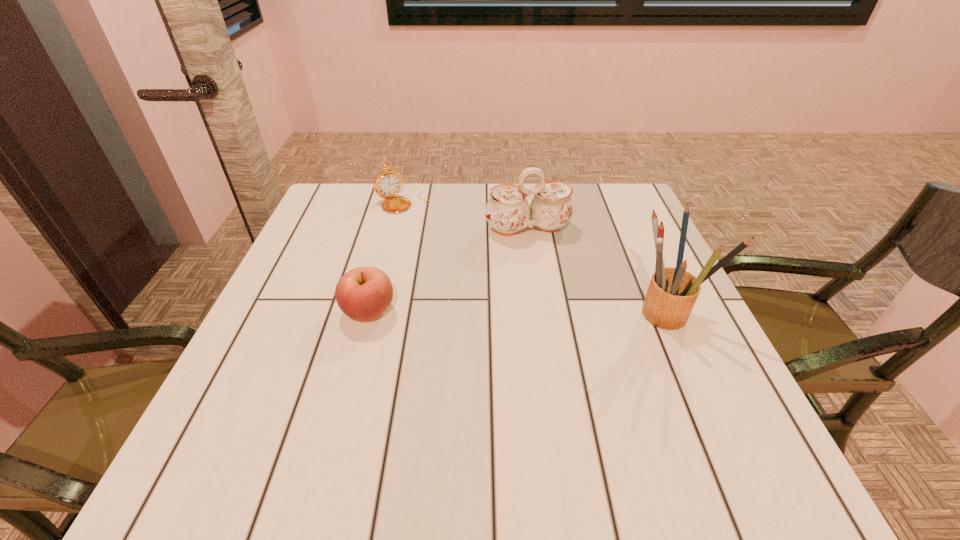
The image size is (960, 540). What are the coordinates of `apple` in the screenshot? It's located at (364, 293).

The image size is (960, 540). What are the coordinates of `pencil box` in the screenshot? It's located at (672, 292).

At what (x,y) coordinates should I click in order to perform the action: click on the rightmost object. Please return your answer as a coordinate pair (x, y). Looking at the image, I should click on (672, 292).

Image resolution: width=960 pixels, height=540 pixels. Identify the location of pocket watch. (387, 184).

Identify the location of the second farthest object. The width and height of the screenshot is (960, 540). (507, 211).

I want to click on the third object from left to right, so click(507, 211).

Where is `free space located on the right of the apple`? free space located on the right of the apple is located at coordinates (464, 312).

Locate an element on the screen. The image size is (960, 540). free space located 0.140m on the front of the pencil box is located at coordinates pyautogui.click(x=706, y=394).

Locate an element on the screen. vacant space located on the face of the pocket watch is located at coordinates (440, 237).

The height and width of the screenshot is (540, 960). Find the location of `vacant space situated 0.340m on the face of the pocket watch`. vacant space situated 0.340m on the face of the pocket watch is located at coordinates (482, 282).